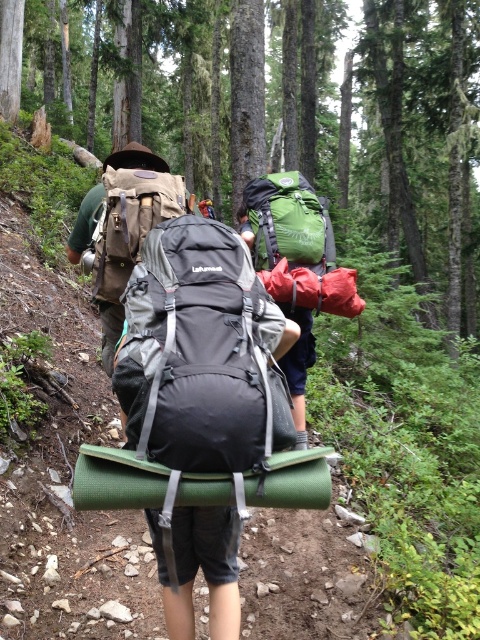
You are a hiker following the trail and see two markers at coordinates point (227,282) and point (271,208). Which marker should you head towards first if you want to stay on the correct path?

You should head towards point (227,282) first because it is in front of point (271,208) along the trail.

You are a hiker standing on the forest trail. You see the black matte backpack at center. Can you reach into your pocket to grab your keys without moving your body? Explain why or why not based on the distance between you and the backpack.

The black matte backpack at center is 5.47 feet away from the viewer. Since this distance is greater than the typical arm length of a person, you cannot reach into your pocket to grab your keys without moving your body.

You are a hiker planning to carry both the black matte backpack at center and the green fabric backpack at center. Which backpack should you choose to carry the heavier items if you want to distribute the weight evenly?

The green fabric backpack at center is larger in size, so it can carry heavier items more comfortably for even weight distribution.